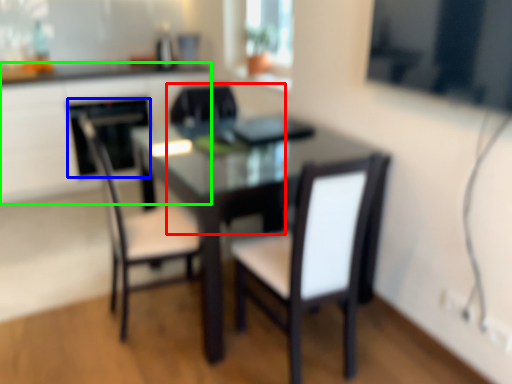
Question: Based on their relative distances, which object is farther from chair (highlighted by a red box)? Choose from appliance (highlighted by a blue box) and computer desk (highlighted by a green box).

Choices:
 (A) appliance
 (B) computer desk

Answer: (B)